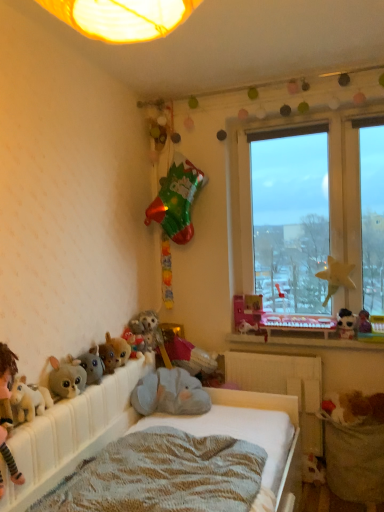
Question: From the image's perspective, would you say fluffy plush toy at lower left, the first toy in the left-to-right sequence, is shown under wooden at lower right?

Choices:
 (A) no
 (B) yes

Answer: (B)

Question: Is fluffy plush toy at lower left, the first toy in the left-to-right sequence, outside wooden at lower right?

Choices:
 (A) yes
 (B) no

Answer: (A)

Question: Is the position of fluffy plush toy at lower left, acting as the 8th toy starting from the right, less distant than that of wooden at lower right?

Choices:
 (A) no
 (B) yes

Answer: (B)

Question: From a real-world perspective, is fluffy plush toy at lower left, acting as the 8th toy starting from the right, on top of wooden at lower right?

Choices:
 (A) no
 (B) yes

Answer: (B)

Question: Considering the relative sizes of fluffy plush toy at lower left, the first toy in the left-to-right sequence, and wooden at lower right in the image provided, is fluffy plush toy at lower left, the first toy in the left-to-right sequence, thinner than wooden at lower right?

Choices:
 (A) yes
 (B) no

Answer: (A)

Question: Considering the positions of white plush toy at right, which appears as the second miniature when viewed from the top, and fluffy plush toy at lower left, acting as the 8th toy starting from the right, in the image, is white plush toy at right, which appears as the second miniature when viewed from the top, taller or shorter than fluffy plush toy at lower left, acting as the 8th toy starting from the right,?

Choices:
 (A) tall
 (B) short

Answer: (B)

Question: In the image, is white plush toy at right, which appears as the second miniature when viewed from the top, on the left side or the right side of fluffy plush toy at lower left, the first toy in the left-to-right sequence?

Choices:
 (A) right
 (B) left

Answer: (A)

Question: From the image's perspective, is white plush toy at right, which appears as the second miniature when viewed from the top, located above or below fluffy plush toy at lower left, acting as the 8th toy starting from the right?

Choices:
 (A) above
 (B) below

Answer: (A)

Question: Is white plush toy at right, the first miniature ordered from the bottom, situated inside fluffy plush toy at lower left, acting as the 8th toy starting from the right, or outside?

Choices:
 (A) inside
 (B) outside

Answer: (B)

Question: Considering the positions of fluffy plush toy at lower left, the first toy in the left-to-right sequence, and fluffy plush toy at lower left in the image, is fluffy plush toy at lower left, the first toy in the left-to-right sequence, wider or thinner than fluffy plush toy at lower left?

Choices:
 (A) thin
 (B) wide

Answer: (A)

Question: Is point (34, 401) positioned closer to the camera than point (1, 435)?

Choices:
 (A) closer
 (B) farther

Answer: (B)

Question: Is fluffy plush toy at lower left, the first toy in the left-to-right sequence, bigger or smaller than fluffy plush toy at lower left?

Choices:
 (A) big
 (B) small

Answer: (B)

Question: From a real-world perspective, is fluffy plush toy at lower left, acting as the 8th toy starting from the right, physically located above or below fluffy plush toy at lower left?

Choices:
 (A) above
 (B) below

Answer: (A)

Question: From a real-world perspective, is fluffy plush toy at lower left, the first toy in the left-to-right sequence, physically located above or below white plastic radiator at center?

Choices:
 (A) above
 (B) below

Answer: (A)

Question: Considering the positions of fluffy plush toy at lower left, the first toy in the left-to-right sequence, and white plastic radiator at center in the image, is fluffy plush toy at lower left, the first toy in the left-to-right sequence, taller or shorter than white plastic radiator at center?

Choices:
 (A) short
 (B) tall

Answer: (A)